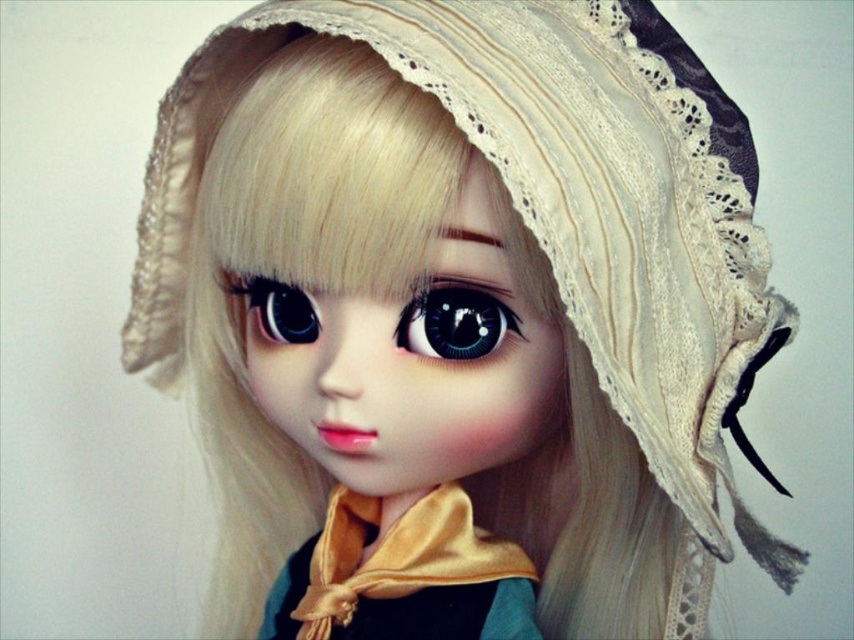
The doll has two eyes, a glossy black eye at center and a satin eye at center. Which one is thinner?

The glossy black eye at center is thinner than the satin eye at center.